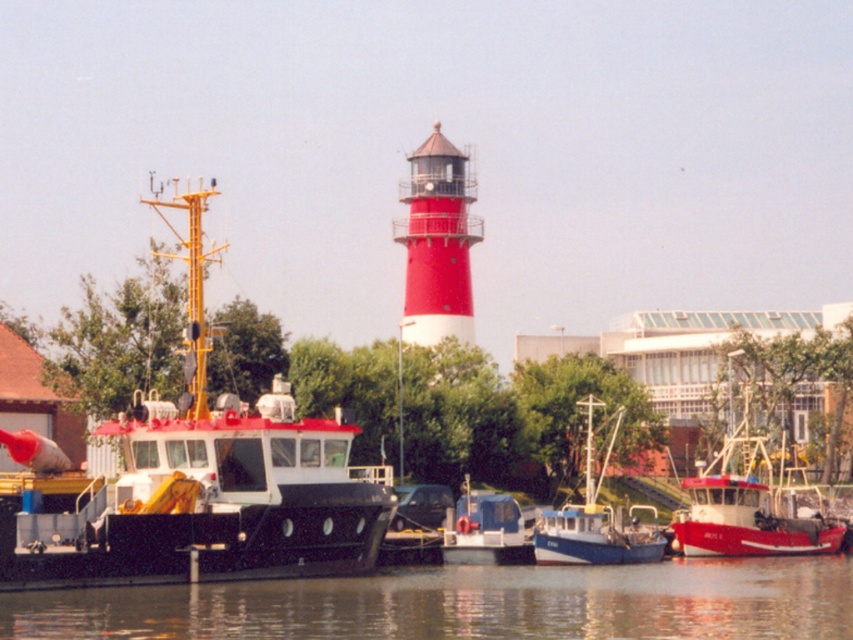
You are a marine biologist planning to launch a small research boat from the dock. Your boat requires a minimum of 150 feet of open water to safely navigate. Based on the scene, can you determine if the distance between the matte black boat at left and the red matte boat at center is sufficient for your needs?

The distance between the matte black boat at left and the red matte boat at center is 134.73 feet, which is less than the required 150 feet. Therefore, the space between them is insufficient for your research boat to navigate safely.

You are an observer standing at the waterfront looking towards the lighthouse. You see the blue matte boat at center and the blue plastic boat at center. Which boat is closer to you?

The blue matte boat at center is closer to you because the blue plastic boat at center is positioned behind it.

Based on the provided coordinates, can you identify which object corresponds to the point at location (469, 604)?

The transparent water at lower center is represented by the point at location (469, 604).